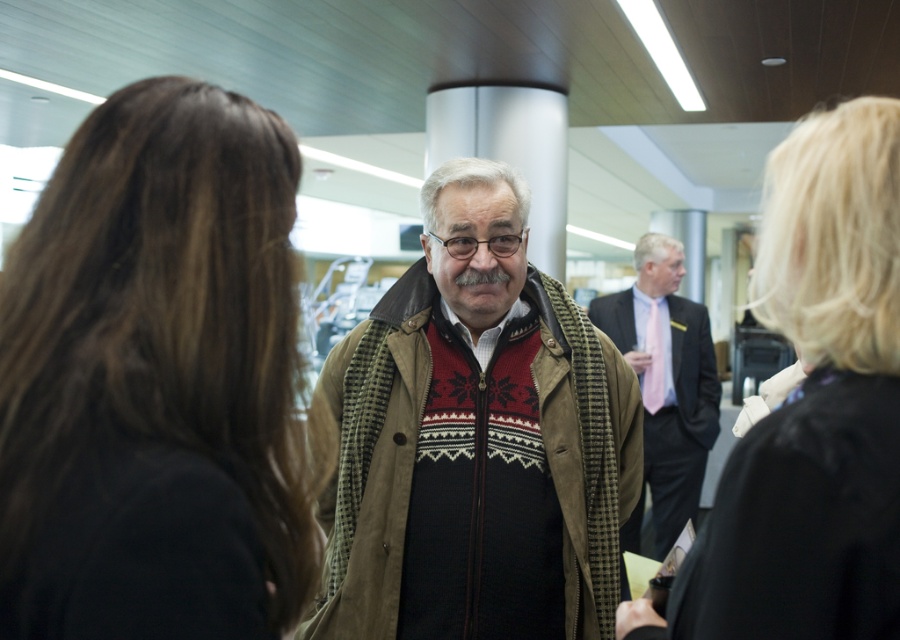
Between point (522, 557) and point (646, 378), which one is positioned in front?

Point (522, 557)

Looking at this image, does knit sweater at center appear under dark suit at center?

No.

Is point (560, 378) positioned after point (691, 372)?

That is False.

This screenshot has height=640, width=900. What are the coordinates of `knit sweater at center` in the screenshot? It's located at (477, 442).

Locate an element on the screen. black leather jacket at right is located at coordinates (813, 408).

This screenshot has height=640, width=900. Describe the element at coordinates (813, 408) in the screenshot. I see `black leather jacket at right` at that location.

At what (x,y) coordinates should I click in order to perform the action: click on black leather jacket at right. Please return your answer as a coordinate pair (x, y). Looking at the image, I should click on (813, 408).

Between point (108, 403) and point (666, 298), which one is positioned behind?

Point (666, 298)

Does brown hair at upper left appear on the left side of dark suit at center?

Indeed, brown hair at upper left is positioned on the left side of dark suit at center.

Describe the element at coordinates (158, 323) in the screenshot. I see `brown hair at upper left` at that location.

Where is `brown hair at upper left`? Image resolution: width=900 pixels, height=640 pixels. brown hair at upper left is located at coordinates (158, 323).